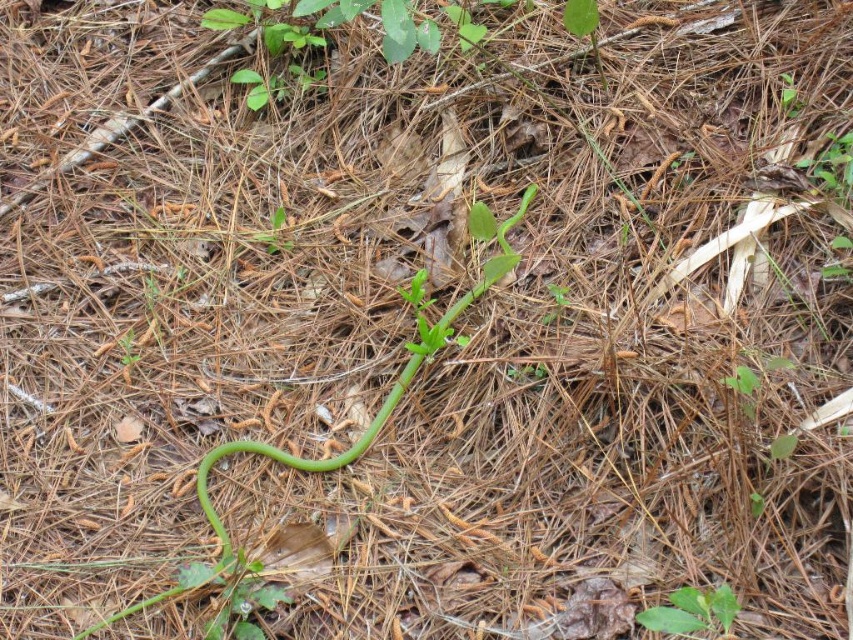
Between green glossy snake at center and green matte leaf at center, which one is positioned higher?

green glossy snake at center is higher up.

Can you confirm if green glossy snake at center is shorter than green matte leaf at center?

No, green glossy snake at center is not shorter than green matte leaf at center.

Is point (384, 412) positioned after point (694, 611)?

Yes, point (384, 412) is farther from viewer.

Locate an element on the screen. This screenshot has height=640, width=853. green glossy snake at center is located at coordinates (364, 429).